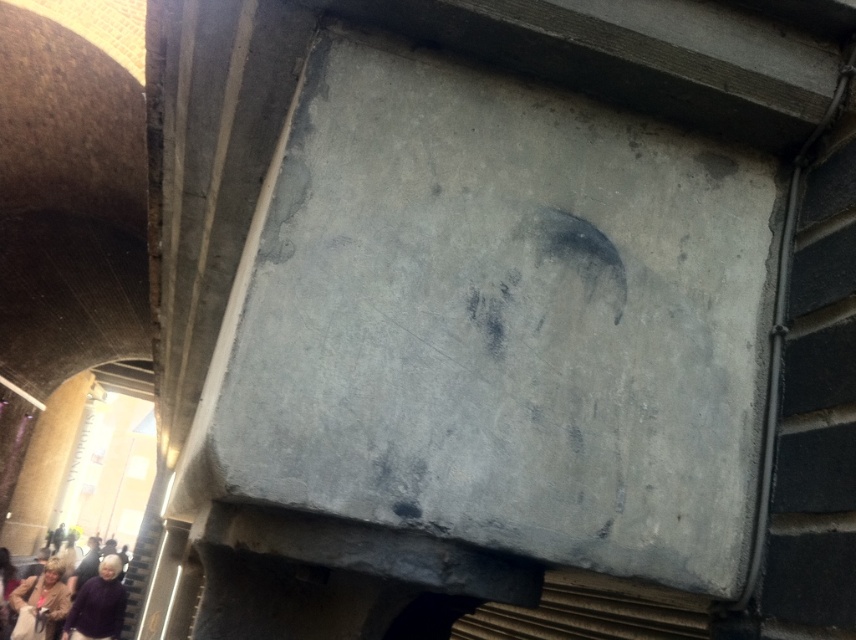
Is the position of smooth gray shutter at right more distant than that of purple sweater at lower left?

No, smooth gray shutter at right is closer to the viewer.

Between point (800, 515) and point (103, 586), which one is positioned behind?

Positioned behind is point (103, 586).

Where is `smooth gray shutter at right`? The height and width of the screenshot is (640, 856). smooth gray shutter at right is located at coordinates [816, 419].

The width and height of the screenshot is (856, 640). In order to click on smooth gray shutter at right in this screenshot , I will do `click(816, 419)`.

Who is positioned more to the right, purple sweater at lower left or light brown leather jacket at lower left?

Positioned to the right is purple sweater at lower left.

Which is more to the left, purple sweater at lower left or light brown leather jacket at lower left?

From the viewer's perspective, light brown leather jacket at lower left appears more on the left side.

Between point (79, 605) and point (62, 588), which one is positioned behind?

Point (62, 588)

Identify the location of purple sweater at lower left. (98, 604).

Does smooth gray shutter at right have a lesser width compared to light brown leather jacket at lower left?

Indeed, smooth gray shutter at right has a lesser width compared to light brown leather jacket at lower left.

Is point (813, 557) positioned before point (10, 632)?

Yes.

Measure the distance between smooth gray shutter at right and camera.

A distance of 38.23 inches exists between smooth gray shutter at right and camera.

Image resolution: width=856 pixels, height=640 pixels. In order to click on smooth gray shutter at right in this screenshot , I will do click(x=816, y=419).